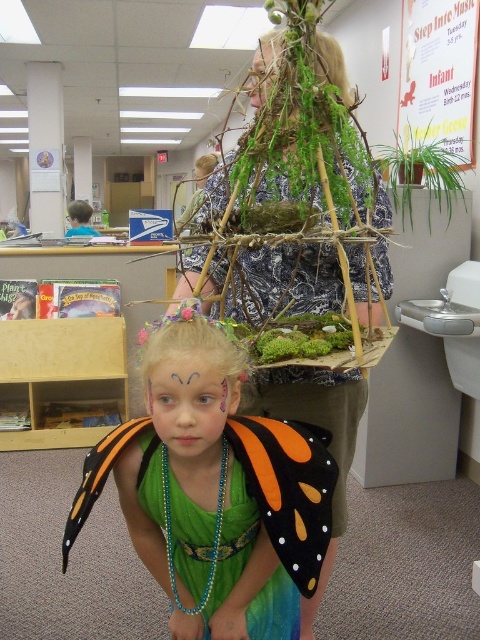
Question: Estimate the real-world distances between objects in this image. Which object is closer to the smooth skin face at center?

Choices:
 (A) pastel face paint at center
 (B) green sequined dress at center
 (C) green leafy plant at upper right

Answer: (A)

Question: Is pastel face paint at center further to the viewer compared to smooth skin at center?

Choices:
 (A) no
 (B) yes

Answer: (A)

Question: Which of these objects is positioned closest to the smooth skin face at center?

Choices:
 (A) green sequined dress at center
 (B) green leafy plant at upper right

Answer: (A)

Question: Is green sequined dress at center bigger than smooth skin face at center?

Choices:
 (A) no
 (B) yes

Answer: (A)

Question: Is green leafy plant at upper right to the left of smooth skin face at center from the viewer's perspective?

Choices:
 (A) yes
 (B) no

Answer: (B)

Question: Which object is the farthest from the smooth skin at center?

Choices:
 (A) smooth skin face at center
 (B) green sequined dress at center

Answer: (A)